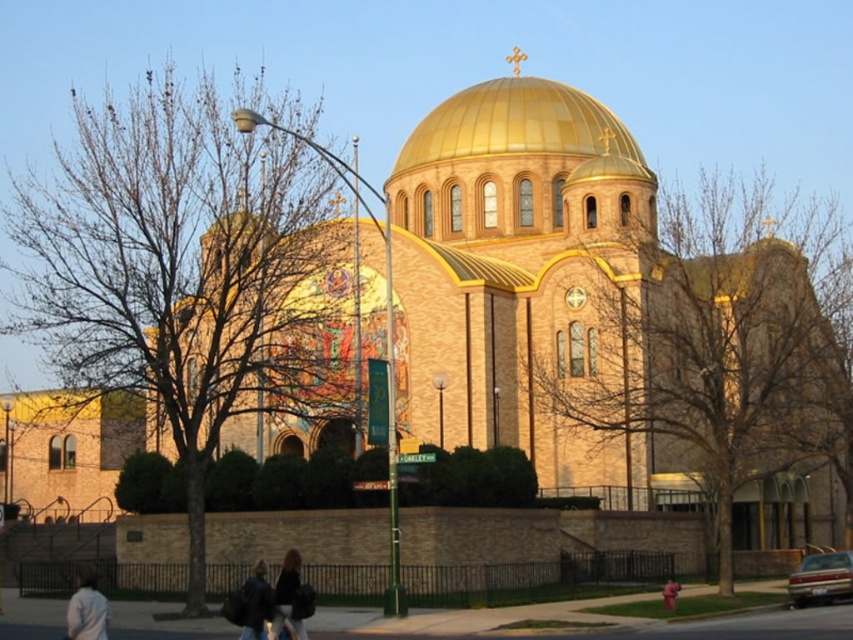
What do you see at coordinates (291, 600) in the screenshot? This screenshot has width=853, height=640. I see `dark brown leather jacket at lower center` at bounding box center [291, 600].

Which is more to the left, dark brown leather jacket at lower center or dark blue jacket at lower center?

Positioned to the left is dark blue jacket at lower center.

The image size is (853, 640). Describe the element at coordinates (291, 600) in the screenshot. I see `dark brown leather jacket at lower center` at that location.

At what (x,y) coordinates should I click in order to perform the action: click on dark brown leather jacket at lower center. Please return your answer as a coordinate pair (x, y). Looking at the image, I should click on (291, 600).

Can you confirm if dark brown leather jacket at lower center is positioned to the left of light gray jacket at lower left?

No, dark brown leather jacket at lower center is not to the left of light gray jacket at lower left.

Who is positioned more to the left, dark brown leather jacket at lower center or light gray jacket at lower left?

Positioned to the left is light gray jacket at lower left.

You are a GUI agent. You are given a task and a screenshot of the screen. Output one action in this format:
    pyautogui.click(x=<x>, y=<y>)
    Task: Click on the dark brown leather jacket at lower center
    
    Given the screenshot: What is the action you would take?
    (291, 600)

Can you confirm if metallic silver sedan at lower right is taller than light gray jacket at lower left?

No.

Can you confirm if metallic silver sedan at lower right is positioned to the right of light gray jacket at lower left?

Correct, you'll find metallic silver sedan at lower right to the right of light gray jacket at lower left.

Where is `metallic silver sedan at lower right`? The height and width of the screenshot is (640, 853). metallic silver sedan at lower right is located at coordinates (821, 579).